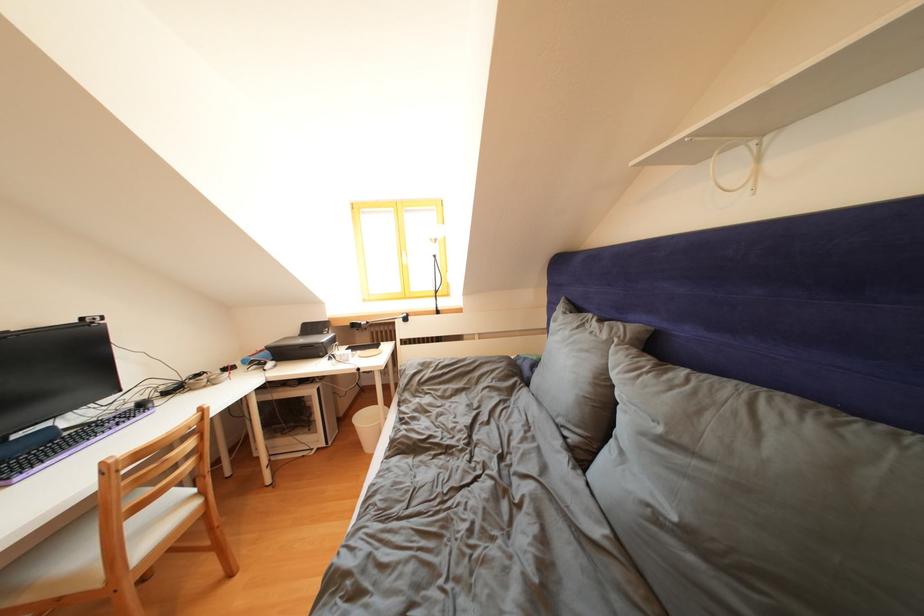
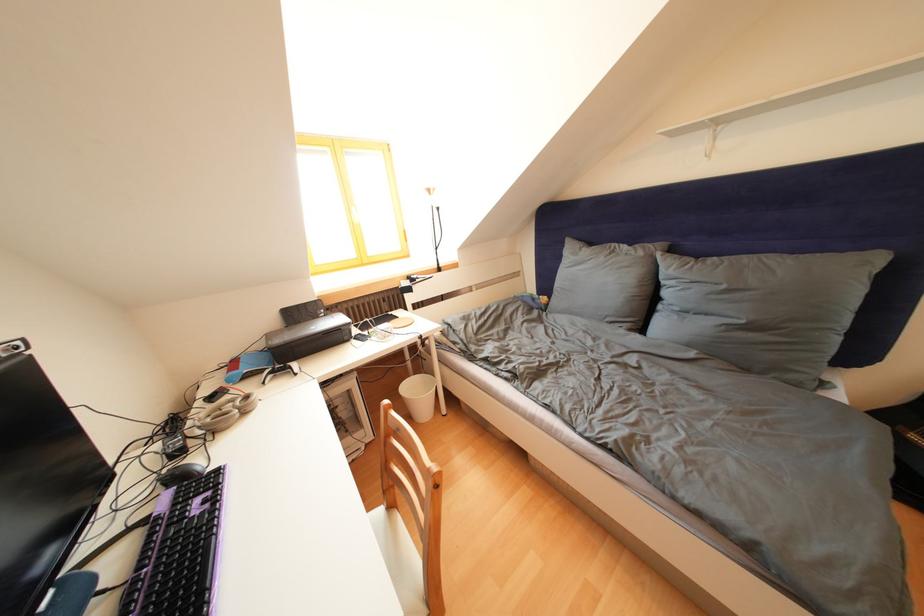
Locate, in the second image, the point that corresponds to (x=233, y=375) in the first image.

(220, 403)